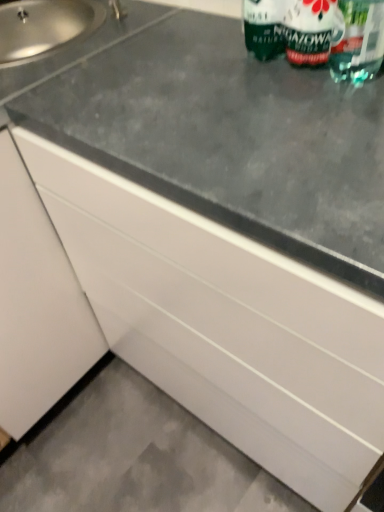
Question: Can you confirm if silver metallic faucet at upper left is positioned to the right of green matte bottle at upper right?

Choices:
 (A) no
 (B) yes

Answer: (A)

Question: Considering the relative sizes of silver metallic faucet at upper left and green matte bottle at upper right in the image provided, is silver metallic faucet at upper left shorter than green matte bottle at upper right?

Choices:
 (A) yes
 (B) no

Answer: (A)

Question: Is silver metallic faucet at upper left smaller than green matte bottle at upper right?

Choices:
 (A) no
 (B) yes

Answer: (B)

Question: Could you tell me if silver metallic faucet at upper left is facing green matte bottle at upper right?

Choices:
 (A) no
 (B) yes

Answer: (A)

Question: Is silver metallic faucet at upper left positioned with its back to green matte bottle at upper right?

Choices:
 (A) no
 (B) yes

Answer: (A)

Question: From a real-world perspective, does silver metallic faucet at upper left stand above green matte bottle at upper right?

Choices:
 (A) yes
 (B) no

Answer: (B)

Question: Would you consider green matte bottle at upper right to be distant from transparent plastic straw at upper right?

Choices:
 (A) no
 (B) yes

Answer: (A)

Question: Does green matte bottle at upper right appear on the right side of transparent plastic straw at upper right?

Choices:
 (A) yes
 (B) no

Answer: (B)

Question: Is green matte bottle at upper right outside of transparent plastic straw at upper right?

Choices:
 (A) yes
 (B) no

Answer: (A)

Question: Is green matte bottle at upper right positioned with its back to transparent plastic straw at upper right?

Choices:
 (A) yes
 (B) no

Answer: (B)

Question: From the image's perspective, is green matte bottle at upper right below transparent plastic straw at upper right?

Choices:
 (A) yes
 (B) no

Answer: (A)

Question: Is green matte bottle at upper right placed right next to transparent plastic straw at upper right?

Choices:
 (A) yes
 (B) no

Answer: (A)

Question: Is green matte bottle at upper right further to the viewer compared to gray concrete at lower left?

Choices:
 (A) yes
 (B) no

Answer: (B)